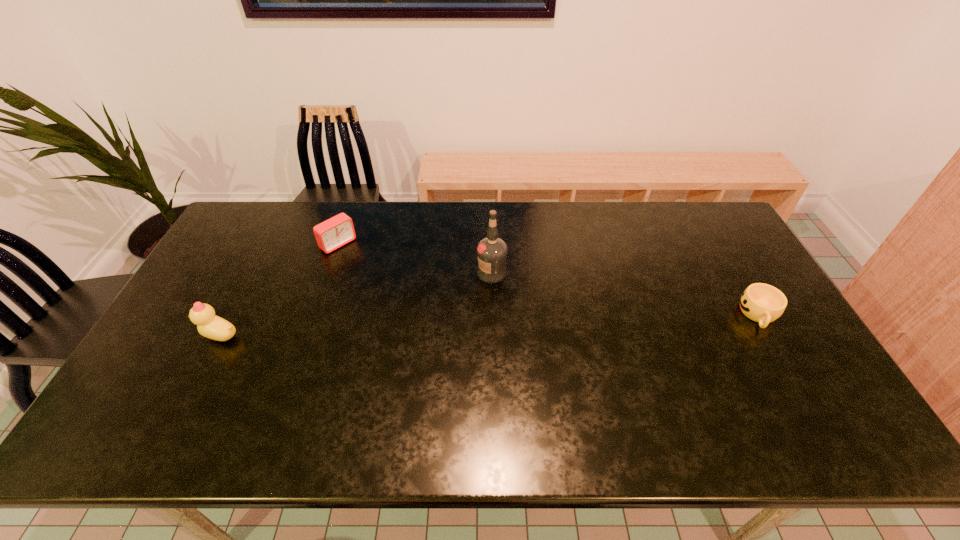
This screenshot has height=540, width=960. Identify the location of free location at the left edge of the desktop. (230, 258).

Where is `free space at the right edge`? free space at the right edge is located at coordinates (738, 320).

Where is `free region at the far left corner of the desktop`? Image resolution: width=960 pixels, height=540 pixels. free region at the far left corner of the desktop is located at coordinates click(279, 218).

Image resolution: width=960 pixels, height=540 pixels. I want to click on vacant point located between the duckling and the second object from left to right, so click(279, 289).

This screenshot has height=540, width=960. I want to click on free space between the third shortest object and the shortest object, so click(490, 325).

Where is `vacant space in between the rightmost object and the duckling`? The image size is (960, 540). vacant space in between the rightmost object and the duckling is located at coordinates (490, 325).

This screenshot has height=540, width=960. What are the coordinates of `free space between the third shortest object and the third object from left to right` in the screenshot? It's located at (356, 304).

Where is `unoccupied area between the shortest object and the farthest object`? unoccupied area between the shortest object and the farthest object is located at coordinates (549, 280).

I want to click on blank region between the second tallest object and the tallest object, so click(x=356, y=304).

You are a GUI agent. You are given a task and a screenshot of the screen. Output one action in this format:
    pyautogui.click(x=<x>, y=<y>)
    Task: Click on the empty space between the leftmost object and the second object from right to left
    This screenshot has width=960, height=540.
    Given the screenshot: What is the action you would take?
    pyautogui.click(x=356, y=304)